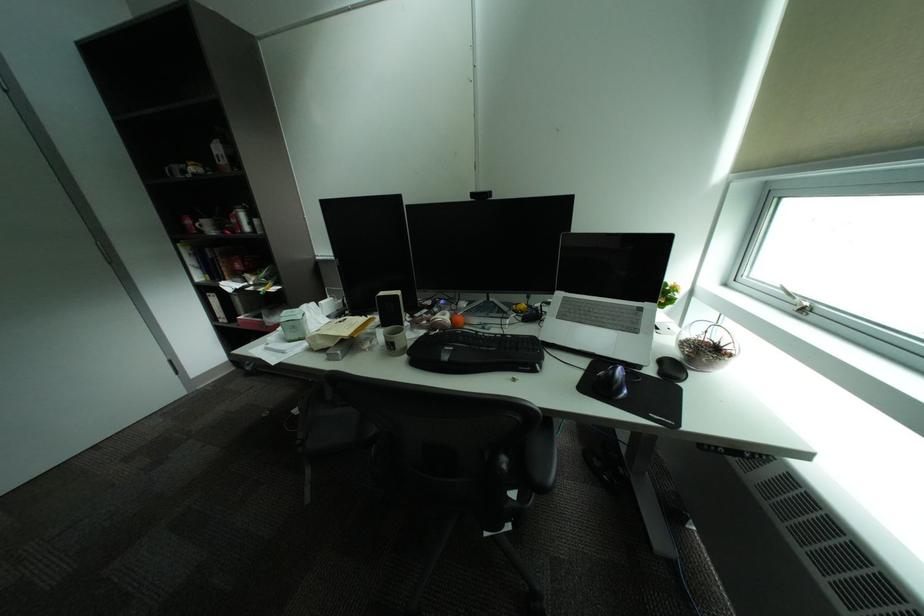
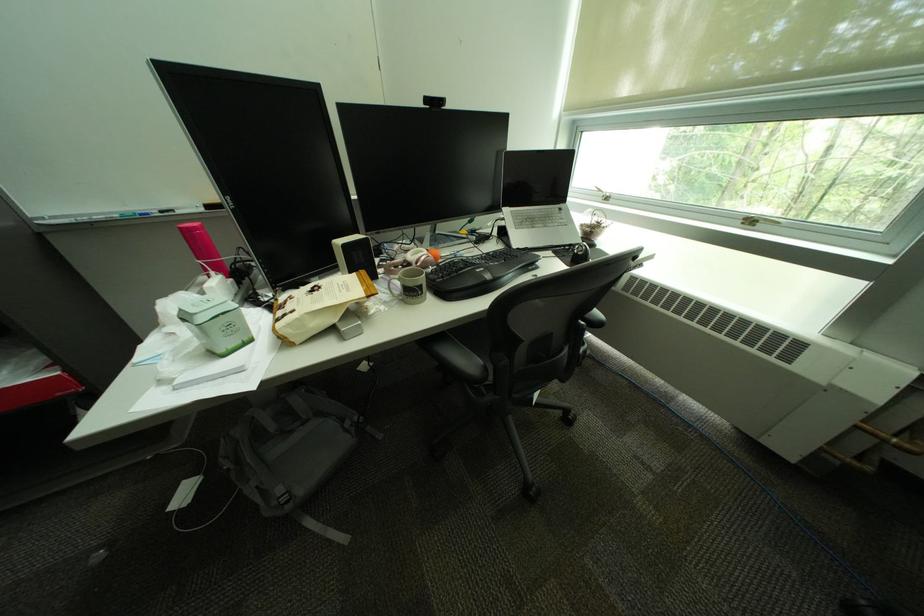
In the second image, find the point that corresponds to point 323,338 in the first image.

(309, 321)